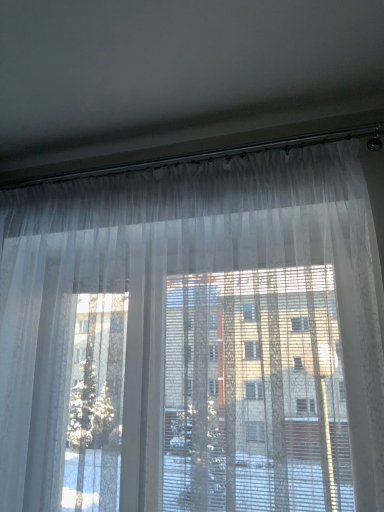
This screenshot has height=512, width=384. Identify the location of sheer white curtain at center. (194, 339).

Describe the element at coordinates (194, 339) in the screenshot. This screenshot has height=512, width=384. I see `sheer white curtain at center` at that location.

Locate an element on the screen. The image size is (384, 512). sheer white curtain at center is located at coordinates tap(194, 339).